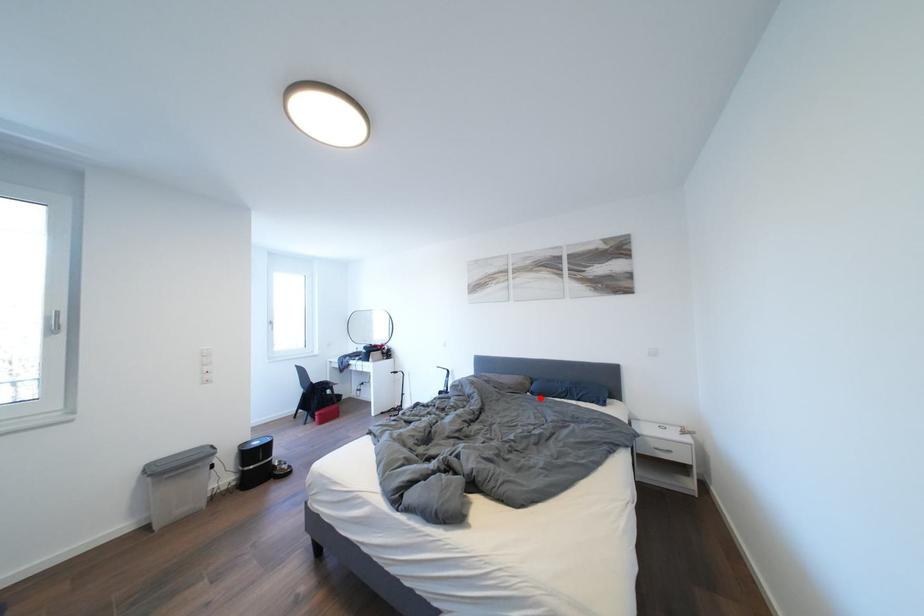
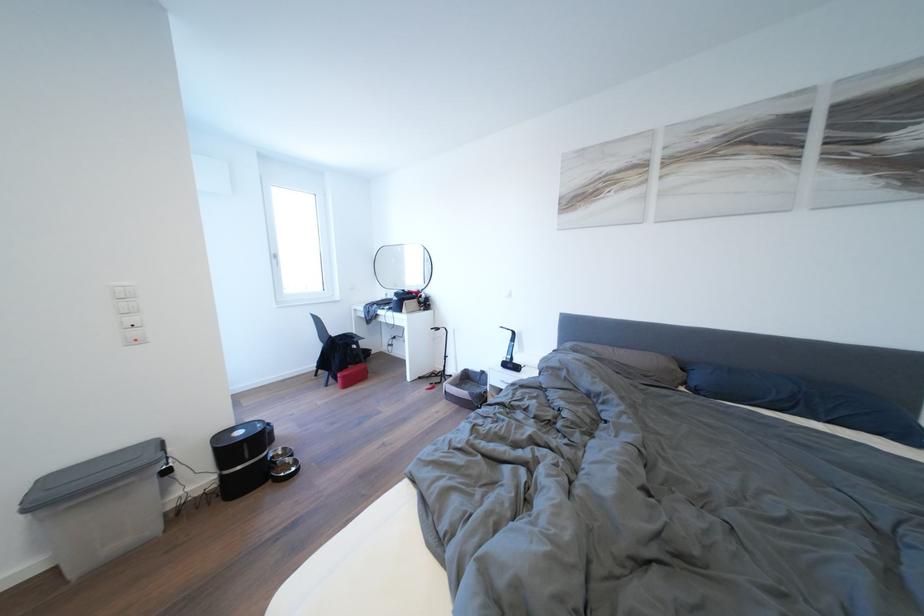
Where in the second image is the point corresponding to the highlighted location from the first image?

(703, 395)